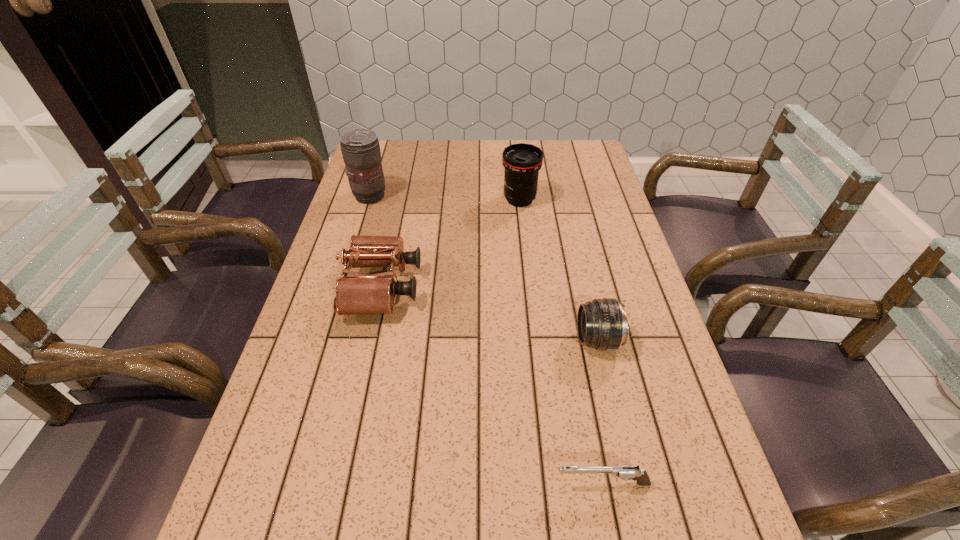
Find the location of a particular element. This screenshot has height=540, width=960. empty location between the rightmost telephoto lens and the second tallest object is located at coordinates (559, 270).

Where is `vacant area that lies between the tallest telephoto lens and the fourth shortest object`? Image resolution: width=960 pixels, height=540 pixels. vacant area that lies between the tallest telephoto lens and the fourth shortest object is located at coordinates (445, 198).

The width and height of the screenshot is (960, 540). I want to click on free spot between the tallest telephoto lens and the pistol, so click(x=487, y=340).

This screenshot has width=960, height=540. Find the location of `vacant space that is in between the second telephoto lens from left to right and the rightmost telephoto lens`. vacant space that is in between the second telephoto lens from left to right and the rightmost telephoto lens is located at coordinates (559, 270).

You are a GUI agent. You are given a task and a screenshot of the screen. Output one action in this format:
    pyautogui.click(x=<x>, y=<y>)
    Task: Click on the empty space that is in between the shortest object and the shortest telephoto lens
    The image size is (960, 540).
    Given the screenshot: What is the action you would take?
    pyautogui.click(x=600, y=411)

Identify which object is the second nearest to the shortest object. Please provide its 2D coordinates. Your answer should be formatted as a tuple, i.e. [(x, y)], where the tuple contains the x and y coordinates of a point satisfying the conditions above.

[(361, 294)]

Identify the location of the third closest object to the leftmost telephoto lens. This screenshot has width=960, height=540. (602, 324).

Identify the location of telephoto lens that is the second closest one to the tallest telephoto lens. (602, 324).

Find the location of `telephoto lens that stands as the closest to the second tallest telephoto lens`. telephoto lens that stands as the closest to the second tallest telephoto lens is located at coordinates (360, 148).

This screenshot has height=540, width=960. In order to click on free space that satisfies the following two spatial constraints: 1. on the back side of the second tallest telephoto lens; 2. on the side of the tallest object where the control switches are located in this screenshot , I will do `click(519, 196)`.